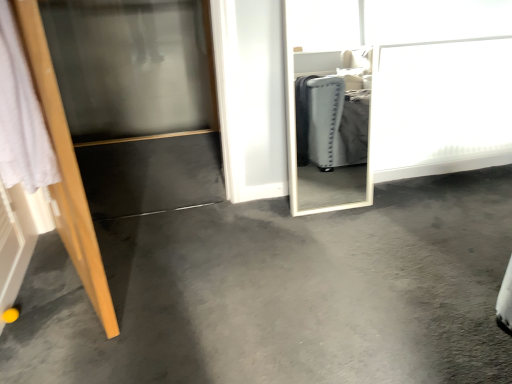
Find the location of a particular element. vacant area located to the right-hand side of wooden door at left is located at coordinates (210, 274).